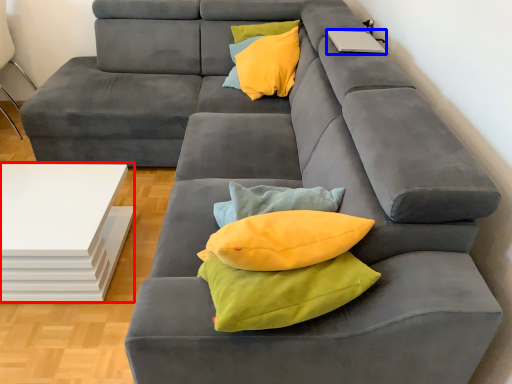
Question: Which of the following is the closest to the observer, table (highlighted by a red box) or laptop (highlighted by a blue box)?

Choices:
 (A) table
 (B) laptop

Answer: (A)